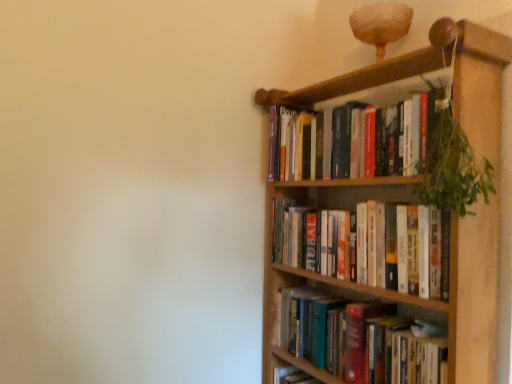
Question: Considering the relative positions of hardcover books at upper right, which appears as the 2th book when viewed from the top, and hardcover books at upper right, which is the 1th book in top-to-bottom order, in the image provided, is hardcover books at upper right, which appears as the 2th book when viewed from the top, to the left of hardcover books at upper right, which is the 1th book in top-to-bottom order, from the viewer's perspective?

Choices:
 (A) yes
 (B) no

Answer: (B)

Question: Is hardcover books at upper right, the 2th book positioned from the bottom, bigger than hardcover books at upper right, which is the 1th book in top-to-bottom order?

Choices:
 (A) no
 (B) yes

Answer: (B)

Question: Can you confirm if hardcover books at upper right, which appears as the 2th book when viewed from the top, is smaller than hardcover books at upper right, the 3th book in the bottom-to-top sequence?

Choices:
 (A) no
 (B) yes

Answer: (A)

Question: Is hardcover books at upper right, the 2th book positioned from the bottom, positioned beyond the bounds of hardcover books at upper right, the 3th book in the bottom-to-top sequence?

Choices:
 (A) no
 (B) yes

Answer: (B)

Question: Are hardcover books at upper right, the 2th book positioned from the bottom, and hardcover books at upper right, the 3th book in the bottom-to-top sequence, located far from each other?

Choices:
 (A) no
 (B) yes

Answer: (A)

Question: Does hardcover books at upper right, the 2th book positioned from the bottom, touch hardcover books at upper right, the 3th book in the bottom-to-top sequence?

Choices:
 (A) no
 (B) yes

Answer: (A)

Question: Is hardcover books at right, marked as the 1th book in a bottom-to-top arrangement, positioned with its back to green leafy plant at upper right?

Choices:
 (A) yes
 (B) no

Answer: (B)

Question: From the image's perspective, is hardcover books at right, marked as the 1th book in a bottom-to-top arrangement, located above green leafy plant at upper right?

Choices:
 (A) no
 (B) yes

Answer: (A)

Question: Can you confirm if hardcover books at right, marked as the third book in a top-to-bottom arrangement, is thinner than green leafy plant at upper right?

Choices:
 (A) yes
 (B) no

Answer: (B)

Question: Is the position of hardcover books at right, marked as the third book in a top-to-bottom arrangement, less distant than that of green leafy plant at upper right?

Choices:
 (A) yes
 (B) no

Answer: (B)

Question: Considering the relative sizes of hardcover books at right, marked as the third book in a top-to-bottom arrangement, and green leafy plant at upper right in the image provided, is hardcover books at right, marked as the third book in a top-to-bottom arrangement, wider than green leafy plant at upper right?

Choices:
 (A) yes
 (B) no

Answer: (A)

Question: Are hardcover books at right, marked as the 1th book in a bottom-to-top arrangement, and green leafy plant at upper right located far from each other?

Choices:
 (A) no
 (B) yes

Answer: (A)

Question: From a real-world perspective, is hardcover books at right, marked as the 1th book in a bottom-to-top arrangement, located beneath wooden bookcase at upper right?

Choices:
 (A) yes
 (B) no

Answer: (A)